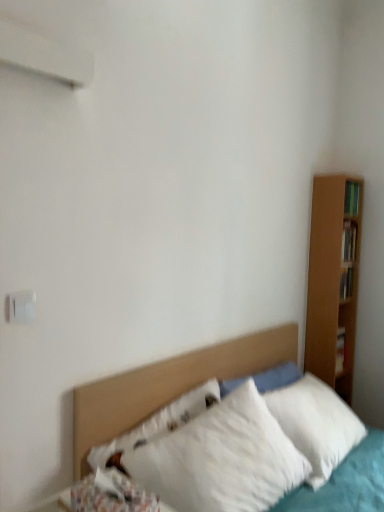
Question: Does point (122, 478) appear closer or farther from the camera than point (31, 315)?

Choices:
 (A) closer
 (B) farther

Answer: (A)

Question: Is fluffy white pillow at lower left wider or thinner than white plastic electric outlet at upper left?

Choices:
 (A) wide
 (B) thin

Answer: (A)

Question: Which is nearer to the fluffy white pillow at lower left?

Choices:
 (A) white plastic electric outlet at upper left
 (B) white fluffy pillows at center

Answer: (B)

Question: Based on their relative distances, which object is nearer to the fluffy white pillow at lower left?

Choices:
 (A) white fluffy pillows at center
 (B) white plastic electric outlet at upper left

Answer: (A)